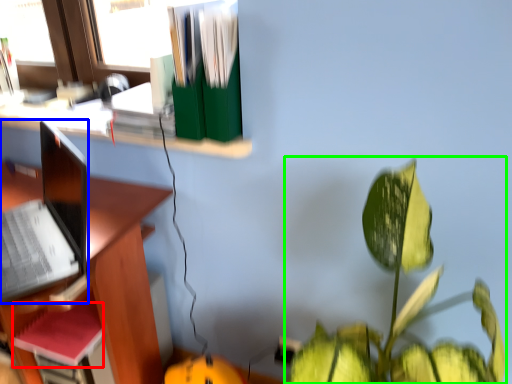
Question: Estimate the real-world distances between objects in this image. Which object is closer to paperback book (highlighted by a red box), laptop (highlighted by a blue box) or houseplant (highlighted by a green box)?

Choices:
 (A) laptop
 (B) houseplant

Answer: (A)